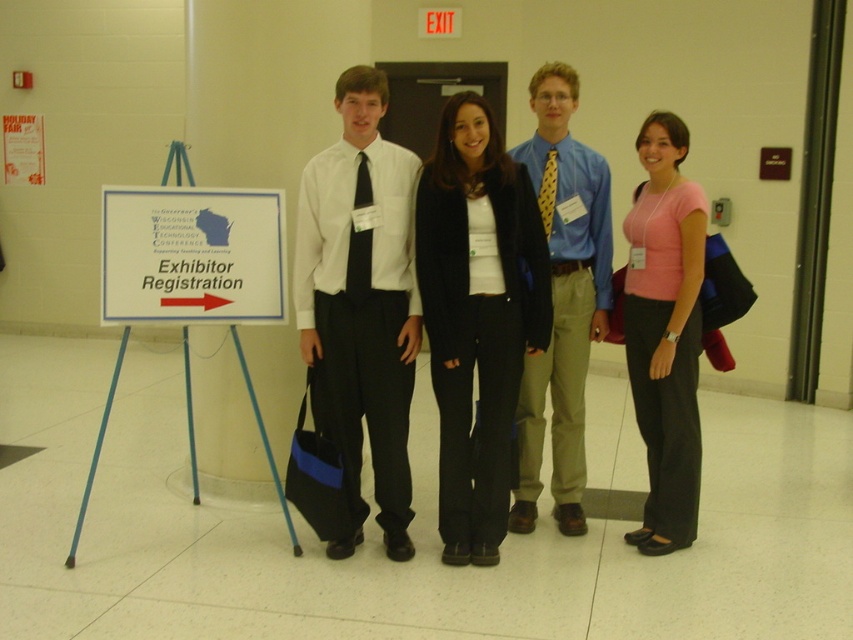
Question: Which point appears closest to the camera in this image?

Choices:
 (A) (660, 396)
 (B) (354, 116)
 (C) (225, 252)
 (D) (523, 244)

Answer: (B)

Question: Does pink fabric shirt at center have a greater width compared to white plastic sign at left?

Choices:
 (A) yes
 (B) no

Answer: (B)

Question: Which object appears closest to the camera in this image?

Choices:
 (A) blue shirt at center
 (B) white plastic sign at left
 (C) black wool blazer at center

Answer: (C)

Question: Does black wool blazer at center appear on the right side of pink fabric shirt at center?

Choices:
 (A) no
 (B) yes

Answer: (A)

Question: Is white matte shirt at center to the left of black wool blazer at center from the viewer's perspective?

Choices:
 (A) yes
 (B) no

Answer: (A)

Question: Which object appears closest to the camera in this image?

Choices:
 (A) white plastic sign at left
 (B) pink fabric shirt at center
 (C) black wool blazer at center

Answer: (C)